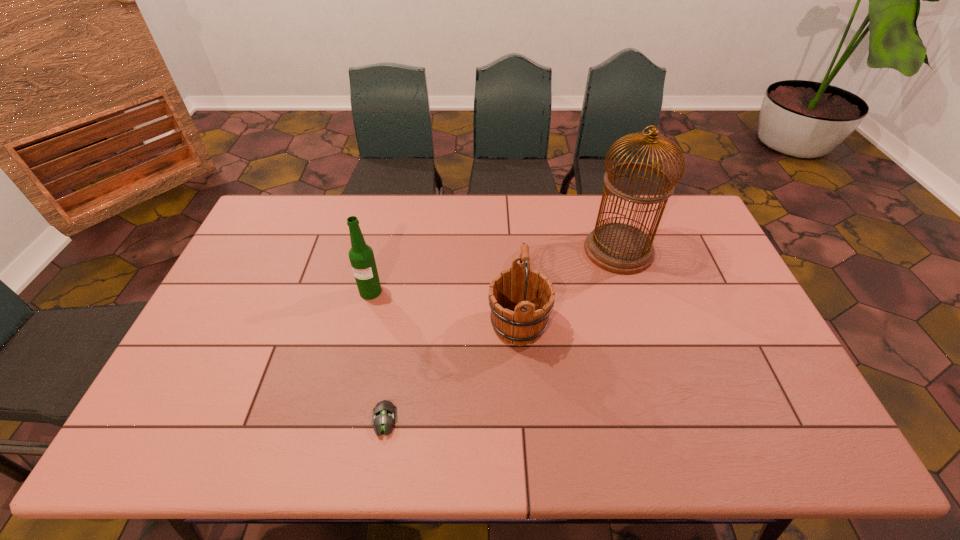
Where is `the tallest object`? the tallest object is located at coordinates (619, 248).

What are the coordinates of `birdcage` in the screenshot? It's located at point(619,248).

Locate an element on the screen. Image resolution: width=960 pixels, height=540 pixels. wine bucket is located at coordinates (521, 299).

Identify the location of beer bottle. The width and height of the screenshot is (960, 540). (361, 256).

Locate an element on the screen. Image resolution: width=960 pixels, height=540 pixels. the second object from left to right is located at coordinates (384, 416).

You are a GUI agent. You are given a task and a screenshot of the screen. Output one action in this format:
    pyautogui.click(x=<x>, y=<y>)
    Task: Click on the computer mouse
    The image size is (960, 540).
    Given the screenshot: What is the action you would take?
    pyautogui.click(x=384, y=416)

Locate an element on the screen. The width and height of the screenshot is (960, 540). vacant region located on the front-facing side of the rightmost object is located at coordinates (546, 251).

The width and height of the screenshot is (960, 540). In order to click on free region located 0.090m on the front-facing side of the rightmost object in this screenshot , I will do `click(558, 251)`.

The image size is (960, 540). What are the coordinates of `vacant space positioned 0.370m on the front-facing side of the rightmost object` in the screenshot? It's located at (474, 251).

You are a GUI agent. You are given a task and a screenshot of the screen. Output one action in this format:
    pyautogui.click(x=<x>, y=<y>)
    Task: Click on the free space located 0.170m on the back of the second object from right to left
    Image resolution: width=960 pixels, height=540 pixels.
    Given the screenshot: What is the action you would take?
    pyautogui.click(x=514, y=260)